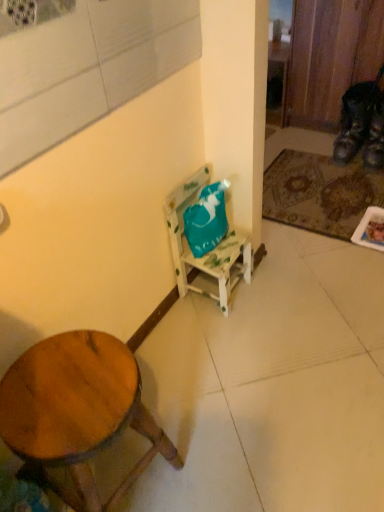
Where is `empty space that is to the right of wooden stool at lower left`? empty space that is to the right of wooden stool at lower left is located at coordinates (209, 452).